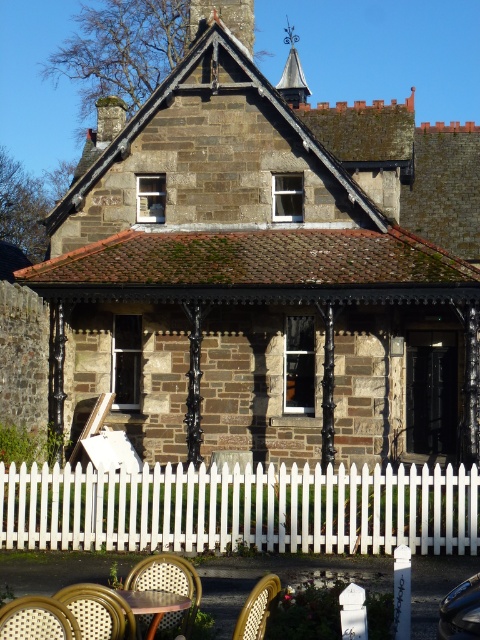
You are standing at the entrance of the stone building and want to sit down. Where exactly is the rattan chair at lower left located in the image?

The rattan chair at lower left is located at point (36,620) in the image.

In the scene shown: You are a painter who needs to decide which object to paint first. Based on their sizes, which object should you tackle first between the white picket fence at lower center and the smooth stone chimney at upper center?

The white picket fence at lower center has a smaller size compared to the smooth stone chimney at upper center, so you should paint the white picket fence at lower center first as it is smaller and may require less time and effort.

You are a drone operator tasked with capturing aerial footage of the building. You need to fly from the wooden table at lower center to the smooth stone chimney at upper center. Given that your drone can only travel 100 feet before needing to recharge, will you be able to make the trip without needing to recharge?

The distance between the smooth stone chimney at upper center and the wooden table at lower center is 85.76 feet, which is less than the drone can travel before needing to recharge. Therefore, the drone can make the trip without needing to recharge.